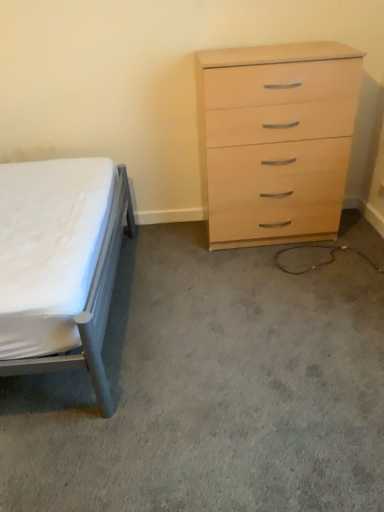
This screenshot has width=384, height=512. I want to click on vacant point above light wood/veneer chest of drawers at right (from a real-world perspective), so click(281, 48).